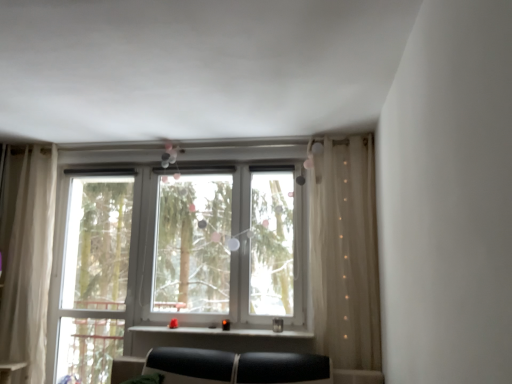
This screenshot has width=512, height=384. I want to click on free space above clear glass window at left (from a real-world perspective), so click(97, 163).